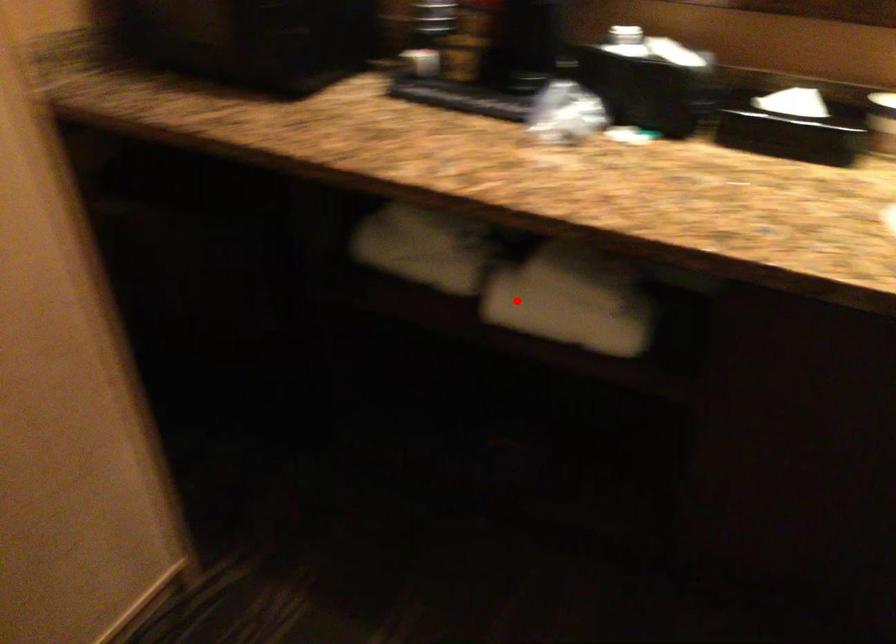
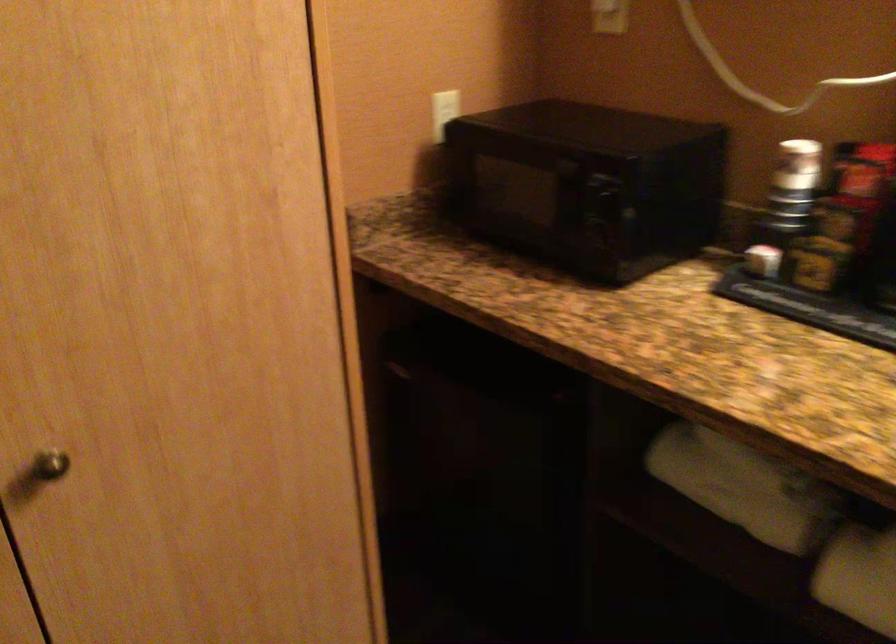
Locate, in the second image, the point that corresponds to the highlighted location in the first image.

(858, 576)